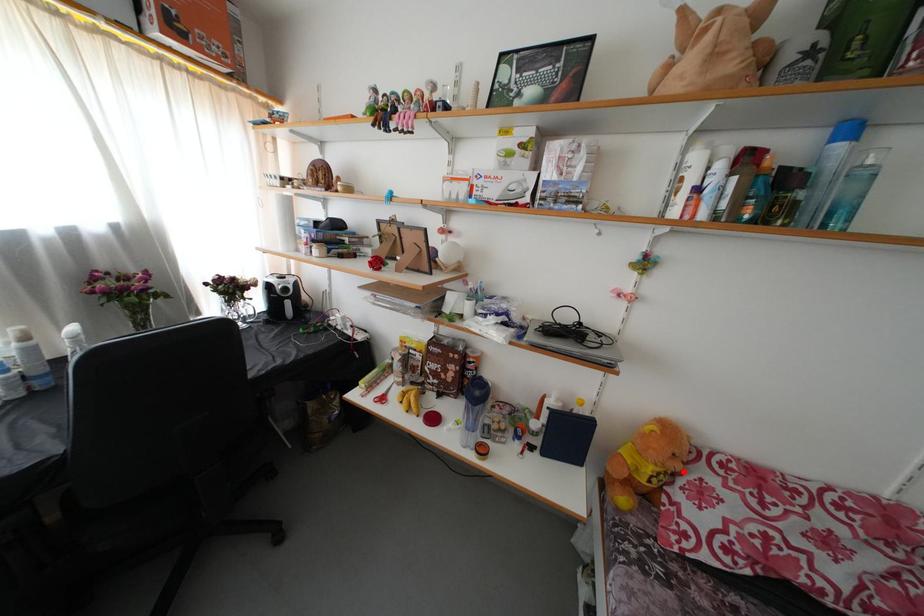
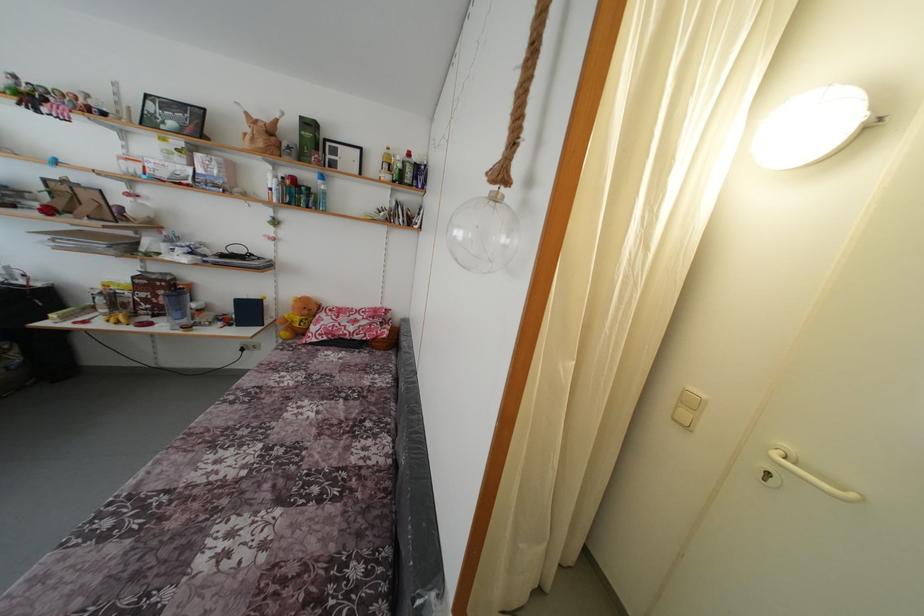
Find the pixel in the second image that matches the highlighted location in the first image.

(310, 317)